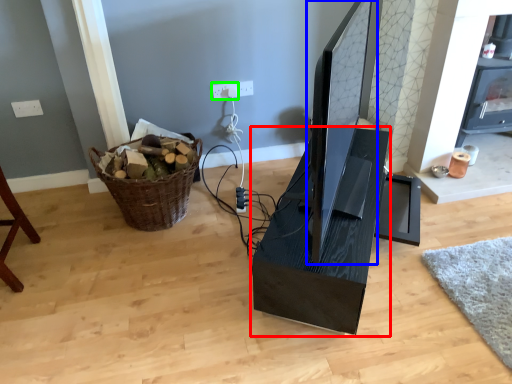
Question: Which is farther away from computer desk (highlighted by a red box)? computer monitor (highlighted by a blue box) or electric outlet (highlighted by a green box)?

Choices:
 (A) computer monitor
 (B) electric outlet

Answer: (B)